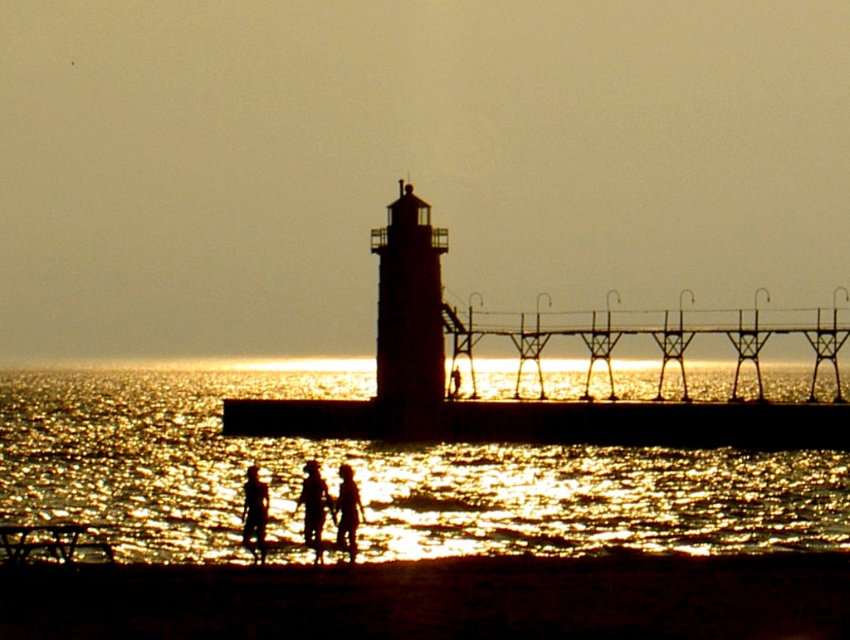
Which of these two, shiny golden water at lower center or silhouette figures at lower center, stands taller?

With more height is shiny golden water at lower center.

I want to click on shiny golden water at lower center, so click(377, 476).

Which is in front, point (335, 451) or point (258, 545)?

Positioned in front is point (258, 545).

Where is `shiny golden water at lower center`? shiny golden water at lower center is located at coordinates (377, 476).

How much distance is there between silhouette figures at lower center and silhouette figure at center?

77.29 centimeters

Can you confirm if silhouette figures at lower center is smaller than silhouette figure at center?

Incorrect, silhouette figures at lower center is not smaller in size than silhouette figure at center.

Locate an element on the screen. Image resolution: width=850 pixels, height=640 pixels. silhouette figures at lower center is located at coordinates (329, 508).

In the scene shown: Which of these two, silhouette figures at lower center or smooth skin person at lower center, stands taller?

Standing taller between the two is silhouette figures at lower center.

How much distance is there between silhouette figures at lower center and smooth skin person at lower center?

A distance of 3.25 meters exists between silhouette figures at lower center and smooth skin person at lower center.

Describe the element at coordinates (329, 508) in the screenshot. The width and height of the screenshot is (850, 640). I see `silhouette figures at lower center` at that location.

The image size is (850, 640). I want to click on silhouette figures at lower center, so click(x=329, y=508).